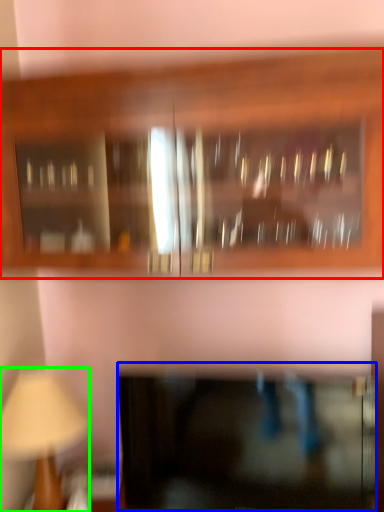
Question: Which is nearer to the cabinetry (highlighted by a red box)? cabinetry (highlighted by a blue box) or table lamp (highlighted by a green box).

Choices:
 (A) cabinetry
 (B) table lamp

Answer: (A)